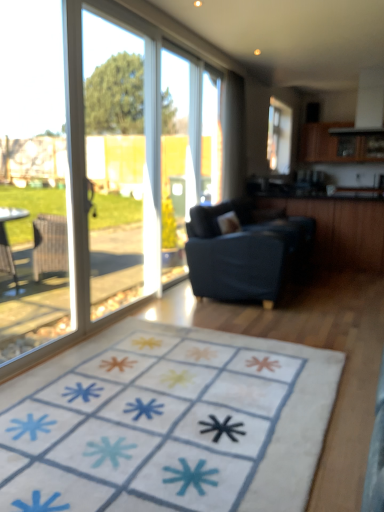
Question: Is transparent plastic window screen at center, which is counted as the second window screen, starting from the left, taller or shorter than white sheer curtain at upper center?

Choices:
 (A) short
 (B) tall

Answer: (A)

Question: Does point (206, 166) appear closer or farther from the camera than point (223, 108)?

Choices:
 (A) farther
 (B) closer

Answer: (B)

Question: Which object is the closest to the white sheer curtain at upper center?

Choices:
 (A) white soft rug at center
 (B) transparent glass window at left, the second window screen when ordered from back to front
 (C) dark blue fabric couch at center
 (D) transparent glass screen door at left
 (E) transparent plastic window screen at center, the 1th window screen in the right-to-left sequence

Answer: (E)

Question: Estimate the real-world distances between objects in this image. Which object is closer to the transparent plastic window screen at center, which is counted as the second window screen, starting from the left?

Choices:
 (A) white soft rug at center
 (B) dark blue fabric couch at center
 (C) transparent glass screen door at left
 (D) white sheer curtain at upper center
 (E) transparent glass window at left, acting as the first window screen starting from the front

Answer: (D)